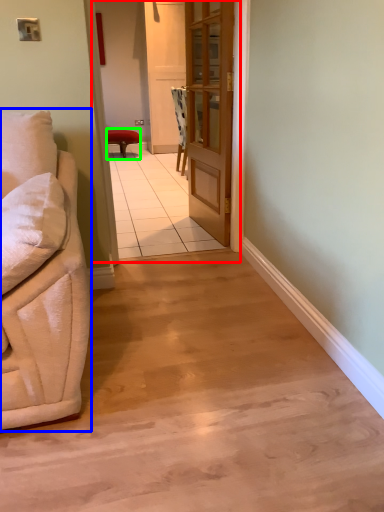
Question: Which object is the farthest from corridor (highlighted by a red box)? Choose among these: studio couch (highlighted by a blue box) or stool (highlighted by a green box).

Choices:
 (A) studio couch
 (B) stool

Answer: (A)